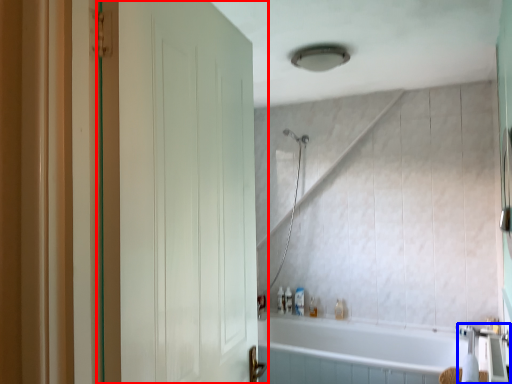
Question: Which of the following is the farthest to the observer, door (highlighted by a red box) or faucet (highlighted by a blue box)?

Choices:
 (A) door
 (B) faucet

Answer: (B)